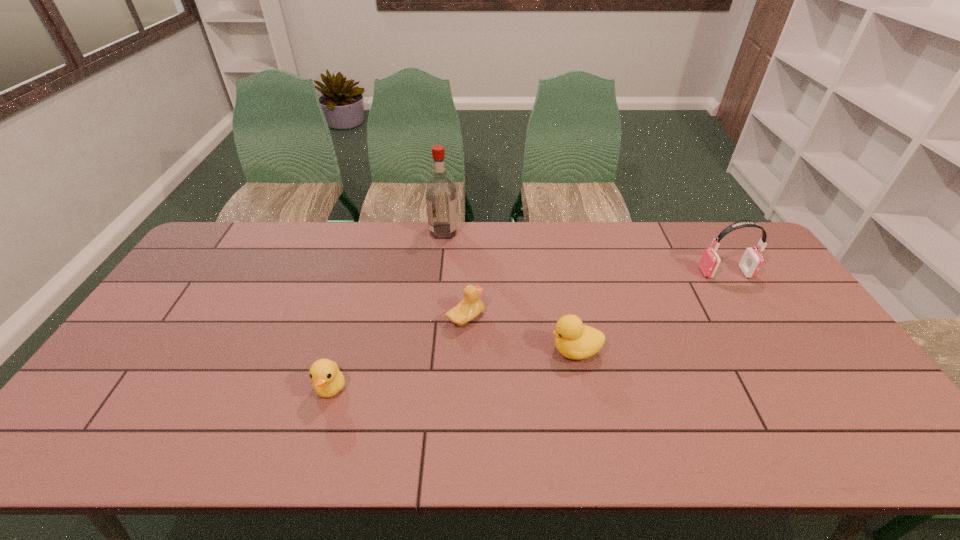
Where is `free region located 0.300m on the front-facing side of the tallest object`? The width and height of the screenshot is (960, 540). free region located 0.300m on the front-facing side of the tallest object is located at coordinates (540, 232).

Find the location of `free space located on the outer surface of the fourth shortest object`. free space located on the outer surface of the fourth shortest object is located at coordinates (649, 273).

Locate an element on the screen. Image resolution: width=960 pixels, height=540 pixels. vacant area located on the outer surface of the fourth shortest object is located at coordinates (649, 273).

Where is `vacant space located on the outer surface of the fourth shortest object`? The height and width of the screenshot is (540, 960). vacant space located on the outer surface of the fourth shortest object is located at coordinates (581, 273).

At what (x,y) coordinates should I click in order to perform the action: click on free location located on the front-facing side of the second nearest duck. Please return your answer as a coordinate pair (x, y). The image size is (960, 540). Looking at the image, I should click on (462, 350).

The image size is (960, 540). In order to click on vacant space situated 0.330m on the front-facing side of the second nearest duck in this screenshot , I will do `click(428, 350)`.

The image size is (960, 540). In order to click on vacant area situated 0.380m on the front-facing side of the second nearest duck in this screenshot , I will do `click(410, 350)`.

Where is `free space located at the beak of the farthest duck`? free space located at the beak of the farthest duck is located at coordinates (585, 318).

At what (x,y) coordinates should I click in order to perform the action: click on free region located on the face of the leftmost duck. Please return your answer as a coordinate pair (x, y). Looking at the image, I should click on (315, 441).

I want to click on object that is at the far edge, so click(x=441, y=203).